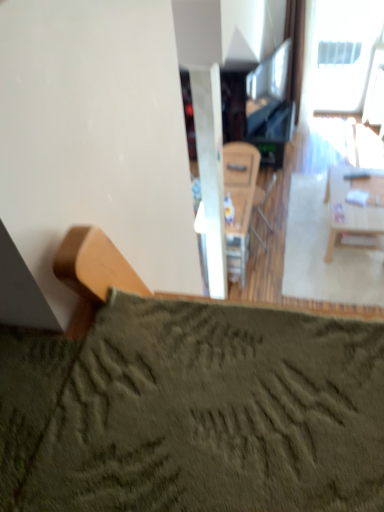
Question: Can you confirm if white plastic window at upper right is wider than light wood table at right?

Choices:
 (A) yes
 (B) no

Answer: (B)

Question: From a real-world perspective, is white plastic window at upper right on top of light wood table at right?

Choices:
 (A) no
 (B) yes

Answer: (B)

Question: From a real-world perspective, is white plastic window at upper right under light wood table at right?

Choices:
 (A) yes
 (B) no

Answer: (B)

Question: Can you confirm if white plastic window at upper right is smaller than light wood table at right?

Choices:
 (A) no
 (B) yes

Answer: (B)

Question: Does white plastic window at upper right have a greater height compared to light wood table at right?

Choices:
 (A) yes
 (B) no

Answer: (A)

Question: Is point (268, 224) closer or farther from the camera than point (334, 223)?

Choices:
 (A) closer
 (B) farther

Answer: (B)

Question: From their relative heights in the image, would you say wooden armchair at center is taller or shorter than light wood table at right?

Choices:
 (A) tall
 (B) short

Answer: (A)

Question: Looking at the image, does wooden armchair at center seem bigger or smaller compared to light wood table at right?

Choices:
 (A) small
 (B) big

Answer: (A)

Question: From a real-world perspective, is wooden armchair at center physically located above or below light wood table at right?

Choices:
 (A) above
 (B) below

Answer: (A)

Question: Is white plastic window at upper right in front of or behind wooden armchair at center in the image?

Choices:
 (A) behind
 (B) front

Answer: (A)

Question: From their relative heights in the image, would you say white plastic window at upper right is taller or shorter than wooden armchair at center?

Choices:
 (A) short
 (B) tall

Answer: (B)

Question: Considering the positions of point (344, 57) and point (254, 193), is point (344, 57) closer or farther from the camera than point (254, 193)?

Choices:
 (A) farther
 (B) closer

Answer: (A)

Question: From the image's perspective, is white plastic window at upper right located above or below wooden armchair at center?

Choices:
 (A) below
 (B) above

Answer: (B)

Question: Looking at the image, does wooden armchair at center seem bigger or smaller compared to white plastic window at upper right?

Choices:
 (A) small
 (B) big

Answer: (A)

Question: Considering the positions of wooden armchair at center and white plastic window at upper right in the image, is wooden armchair at center taller or shorter than white plastic window at upper right?

Choices:
 (A) short
 (B) tall

Answer: (A)